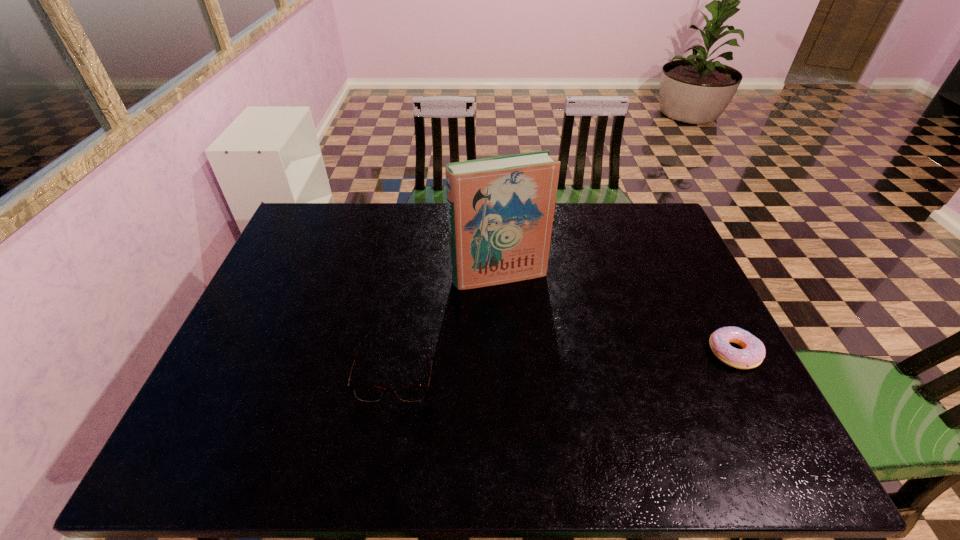
I want to click on spectacles, so click(x=371, y=393).

Image resolution: width=960 pixels, height=540 pixels. Identify the location of the second tallest object. (371, 393).

Where is `the shortest object`? the shortest object is located at coordinates (753, 352).

Identify the location of the rightmost object. (753, 352).

The image size is (960, 540). What are the coordinates of `the tallest object` in the screenshot? It's located at (500, 209).

Where is `the second object from right to left`? Image resolution: width=960 pixels, height=540 pixels. the second object from right to left is located at coordinates click(x=500, y=209).

The width and height of the screenshot is (960, 540). I want to click on vacant space located on the front of the doughnut, so coord(766,414).

This screenshot has height=540, width=960. In order to click on free location located on the cover of the farthest object in this screenshot , I will do `click(549, 375)`.

Identify the location of vacant area located on the cover of the farthest object. (527, 326).

Identify the location of vacant space located 0.360m on the cover of the farthest object. (558, 396).